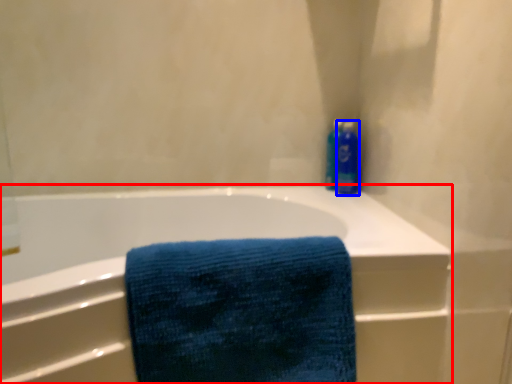
Question: Which of the following is the farthest to the observer, bathtub (highlighted by a red box) or cleaning product (highlighted by a blue box)?

Choices:
 (A) bathtub
 (B) cleaning product

Answer: (B)